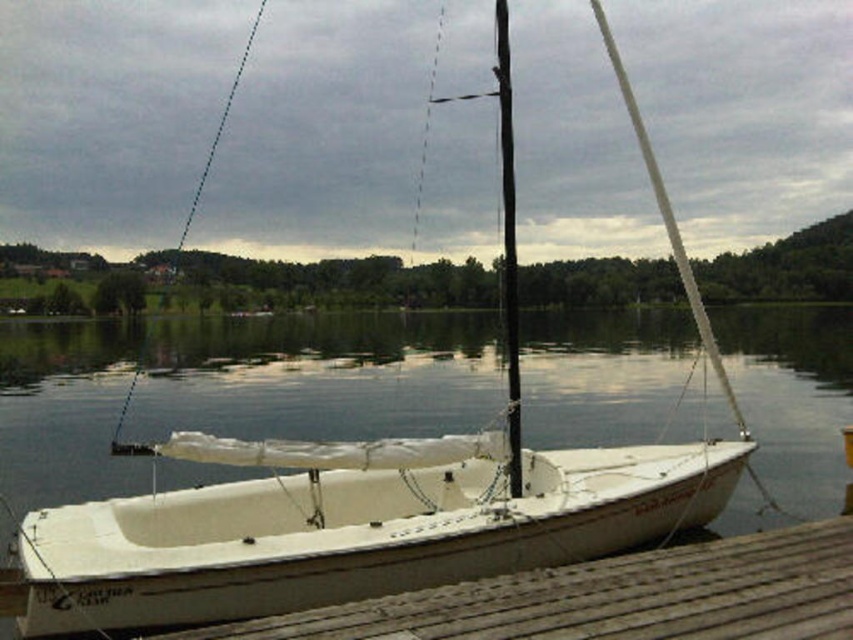
You are a boat operator who needs to navigate a 25 meter long barge through the lake. The barge requires a minimum of 25 meters of clearance between the white matte water at center and wooden at lower left to pass safely. Based on the scene, can the barge safely navigate this route?

The distance between the white matte water at center and wooden at lower left is 27.17 meters, which is greater than the required 25 meters. Therefore, the barge can safely navigate this route as there is sufficient clearance.

You are planning to store both the white matte sailboat at center and the wooden at lower left in a storage facility. The storage area can only accommodate the smaller of the two. Which object should you choose to store there?

The wooden at lower left is smaller in size compared to the white matte sailboat at center, so you should choose to store the wooden at lower left in the storage facility.